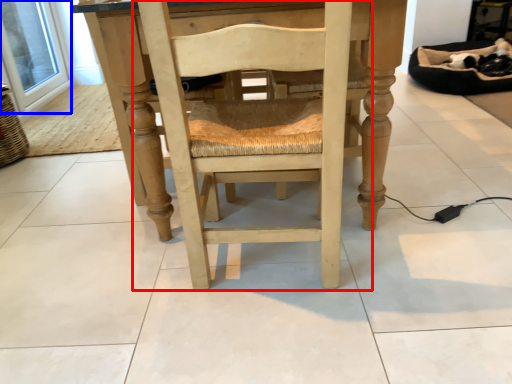
Question: Which point is closer to the camera, chair (highlighted by a red box) or window screen (highlighted by a blue box)?

Choices:
 (A) chair
 (B) window screen

Answer: (A)